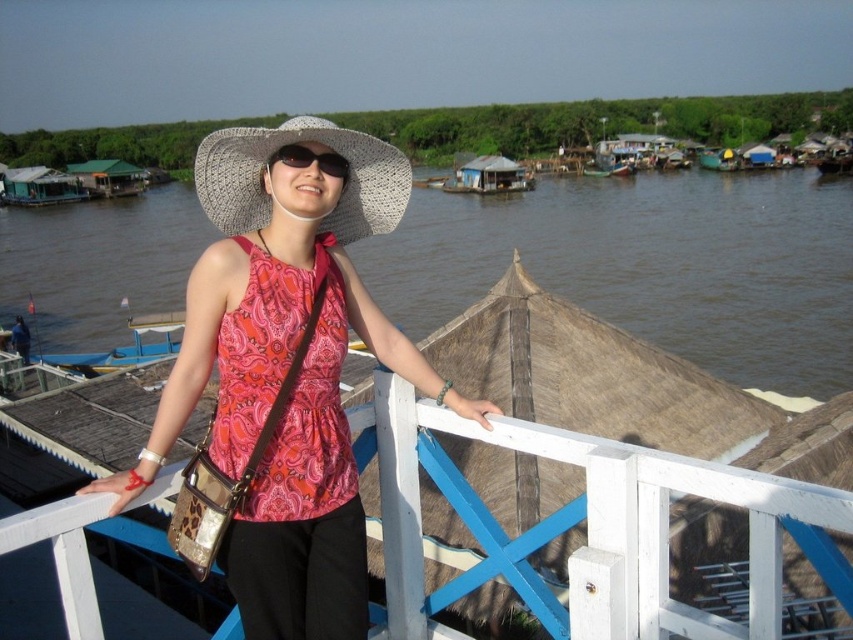
You are standing at point (x=169, y=316) and want to move to point (x=167, y=301). Based on the scene description, which direction should you move to reach your destination?

You should move backward to reach point (x=167, y=301) because it is behind point (x=169, y=316).